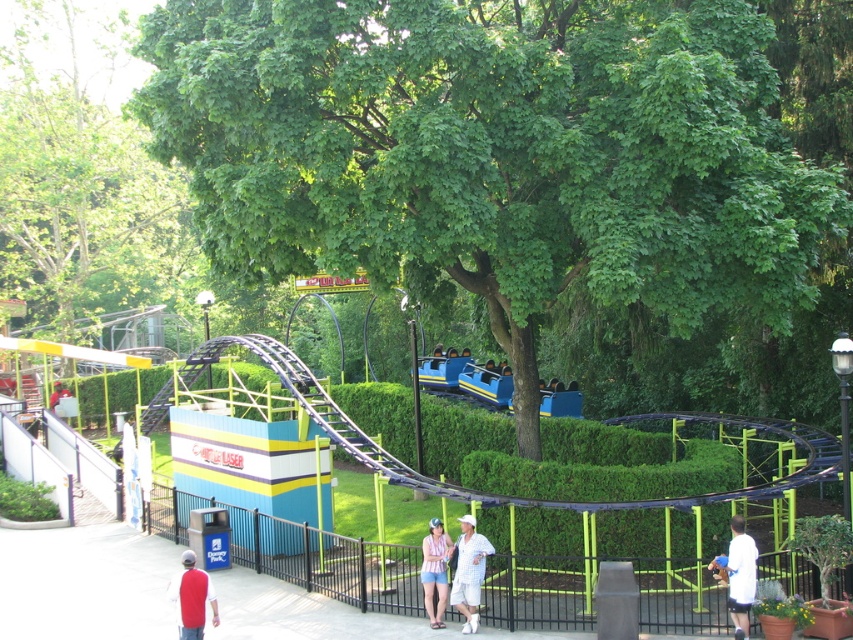
In the scene shown: You are standing at the point labeled point (193, 566) and want to walk towards the roller coaster. Is there an obstacle between you and point (430, 593)?

The point labeled point (193, 566) is in front of point (430, 593), so there is no obstacle between them.

You are a photographer trying to capture a clear shot of the red cotton shirt at lower left without any obstructions. Given the presence of the green leafy tree at upper center, do you think the tree will block your view of the shirt?

The green leafy tree at upper center is much taller than the red cotton shirt at lower left, so it might block part of the view depending on the angle, but since the shirt is at lower left and the tree is at upper center, the tree likely won

You are a photographer trying to capture a clear shot of the red cotton shirt at lower left without the green leafy tree at upper center blocking the view. Based on their positions, is this possible?

The green leafy tree at upper center is positioned on the left side of the red cotton shirt at lower left. Since the tree is to the left of the shirt, you can position yourself to the right of the shirt to avoid the tree blocking the view.